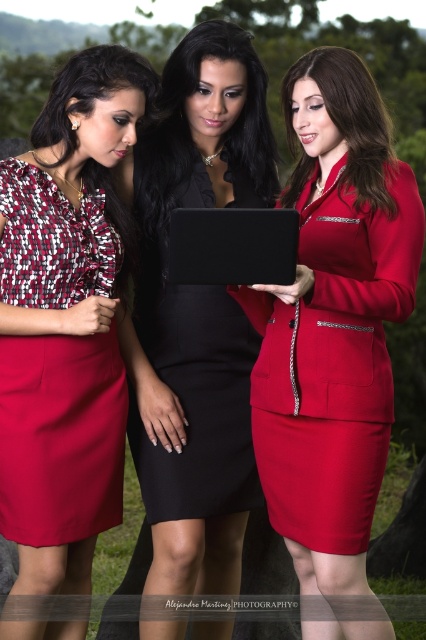
Can you confirm if matte red dress at left is smaller than matte black dress at center?

Yes, matte red dress at left is smaller than matte black dress at center.

Who is more distant from viewer, (54, 376) or (382, 198)?

Point (54, 376)

Which is in front, point (55, 468) or point (356, 109)?

Point (356, 109) is in front.

Locate an element on the screen. Image resolution: width=426 pixels, height=640 pixels. matte red dress at left is located at coordinates (60, 436).

Does matte black dress at center have a greater width compared to black matte tablet at center?

Yes, matte black dress at center is wider than black matte tablet at center.

Between point (359, 152) and point (204, 280), which one is positioned in front?

Positioned in front is point (204, 280).

What do you see at coordinates (348, 120) in the screenshot?
I see `matte black dress at center` at bounding box center [348, 120].

Find the location of a particular element. This screenshot has width=426, height=640. matte black dress at center is located at coordinates (348, 120).

Which is behind, point (322, 112) or point (271, 260)?

Positioned behind is point (322, 112).

Does point (316, 273) come farther from viewer compared to point (230, 248)?

Yes, it is behind point (230, 248).

Is point (370, 266) positioned in front of point (218, 282)?

No, it is behind (218, 282).

The height and width of the screenshot is (640, 426). What are the coordinates of `matte black tablet at center` in the screenshot? It's located at (333, 321).